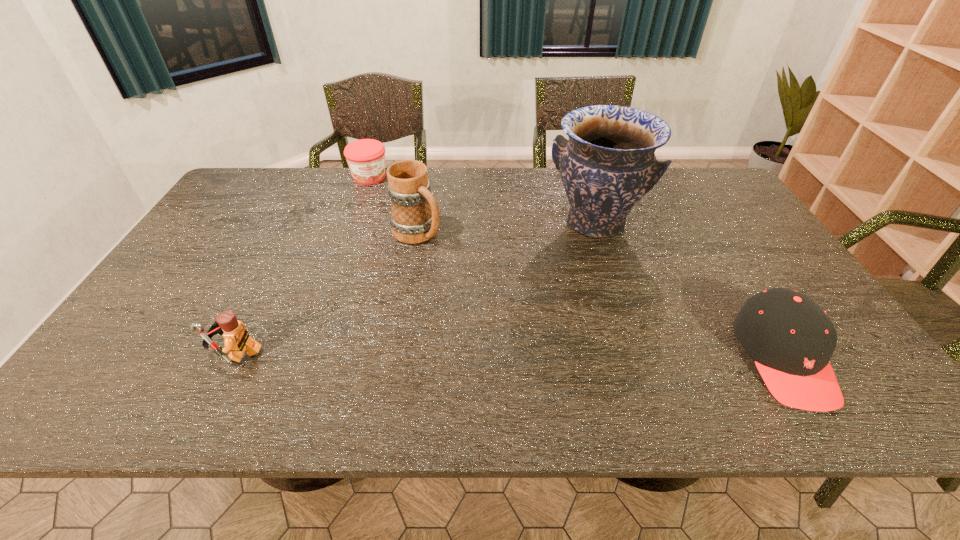
Locate an element on the screen. This screenshot has width=960, height=540. free spot at the near left corner of the desktop is located at coordinates [x=163, y=357].

What are the coordinates of `free space at the far right corner of the desktop` in the screenshot? It's located at (714, 192).

The height and width of the screenshot is (540, 960). In order to click on free spot between the second object from right to left and the mug in this screenshot , I will do `click(506, 228)`.

Where is `free space between the mug and the Lego`? Image resolution: width=960 pixels, height=540 pixels. free space between the mug and the Lego is located at coordinates (326, 293).

Locate an element on the screen. The height and width of the screenshot is (540, 960). vacant space that's between the second object from left to right and the Lego is located at coordinates (302, 265).

Identify the location of vacant region between the Lego and the second object from right to left. The image size is (960, 540). point(416,288).

You are a GUI agent. You are given a task and a screenshot of the screen. Output one action in this format:
    pyautogui.click(x=<x>, y=<y>)
    Task: Click on the vacant area that lies between the second object from right to left and the mug
    The height and width of the screenshot is (540, 960).
    Given the screenshot: What is the action you would take?
    pyautogui.click(x=506, y=228)

Find the location of `the closest object to the rightmost object`. the closest object to the rightmost object is located at coordinates (608, 164).

Where is `the second closest object to the pottery`? the second closest object to the pottery is located at coordinates (414, 219).

This screenshot has width=960, height=540. Identify the location of free space that satisfies the following two spatial constraints: 1. on the front side of the shortest object; 2. on the left side of the fourth object from left to right. (353, 223).